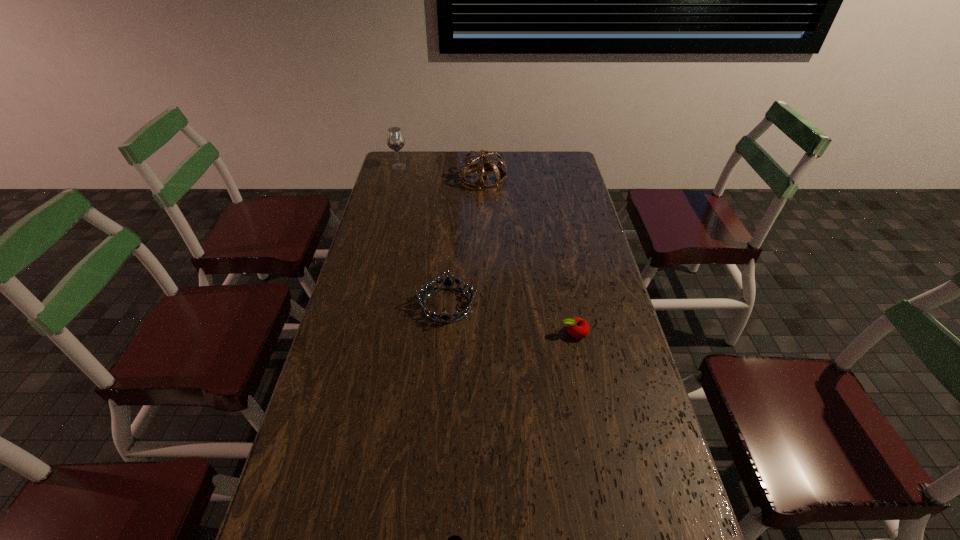
Find the location of a particular element. blank space located 0.070m on the back of the apple is located at coordinates (569, 307).

Identify the location of wineglass that is at the far edge. Image resolution: width=960 pixels, height=540 pixels. (395, 140).

I want to click on tiara that is at the far edge, so click(x=484, y=162).

Identify the location of object that is positioned at the left edge. This screenshot has height=540, width=960. (395, 140).

This screenshot has height=540, width=960. In order to click on object that is at the right edge in this screenshot , I will do `click(578, 328)`.

Where is `object situated at the far left corner`? The height and width of the screenshot is (540, 960). object situated at the far left corner is located at coordinates (x=395, y=140).

Locate an element on the screen. This screenshot has height=540, width=960. vacant space at the far edge of the desktop is located at coordinates (511, 157).

Where is `free space at the left edge of the desktop`? free space at the left edge of the desktop is located at coordinates (344, 386).

Identify the location of free space at the right edge of the desktop. This screenshot has height=540, width=960. (621, 394).

I want to click on blank area at the far left corner, so pos(411,172).